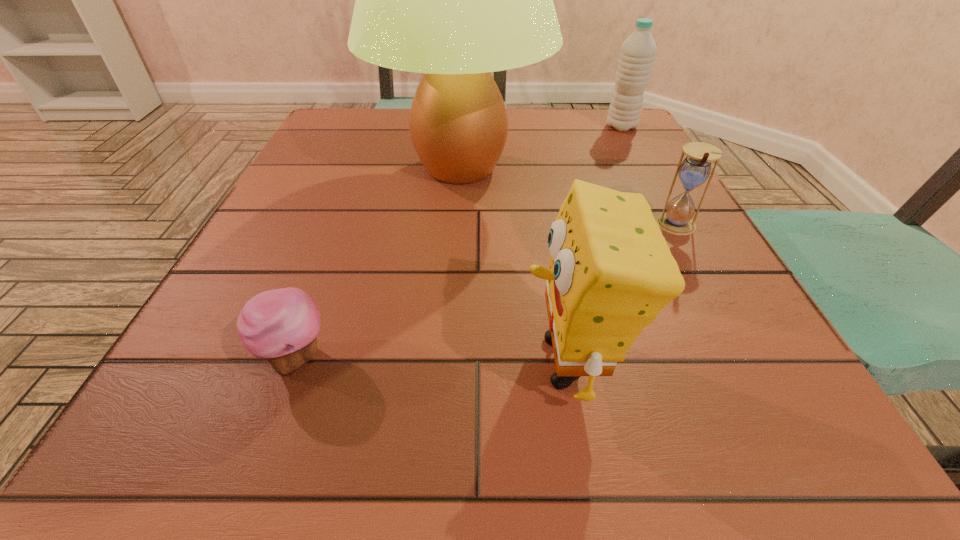
The width and height of the screenshot is (960, 540). What are the coordinates of `free space between the second shortest object and the shortest object` in the screenshot? It's located at (486, 292).

At what (x,y) coordinates should I click in order to perform the action: click on empty location between the lampshade and the cupcake. Please return your answer as a coordinate pair (x, y). This screenshot has width=960, height=540. Looking at the image, I should click on (377, 263).

Locate an element on the screen. This screenshot has width=960, height=540. free spot between the tallest object and the water bottle is located at coordinates (540, 147).

Identify the location of vacant space that is in between the cupcake and the second shortest object. This screenshot has width=960, height=540. (486, 292).

Where is `free area in between the water bottle and the hourglass`? free area in between the water bottle and the hourglass is located at coordinates (649, 177).

Find the location of a particular element. The height and width of the screenshot is (540, 960). free space between the water bottle and the fourth tallest object is located at coordinates (649, 177).

You are a GUI agent. You are given a task and a screenshot of the screen. Output one action in this format:
    pyautogui.click(x=<x>, y=<y>)
    Task: Click on the vacant area that lies between the water bottle and the shortest object
    The height and width of the screenshot is (540, 960).
    Given the screenshot: What is the action you would take?
    pyautogui.click(x=458, y=242)

Identify the location of the third closest object relative to the hourglass. (638, 51).

Where is `object that is the second closest to the sponge`? The height and width of the screenshot is (540, 960). object that is the second closest to the sponge is located at coordinates (455, 0).

At what (x,y) coordinates should I click in order to perform the action: click on free location that satisfies the following two spatial constraints: 1. on the front side of the fourth tallest object; 2. on the face of the sponge. Please return your answer as a coordinate pair (x, y). Looking at the image, I should click on (751, 362).